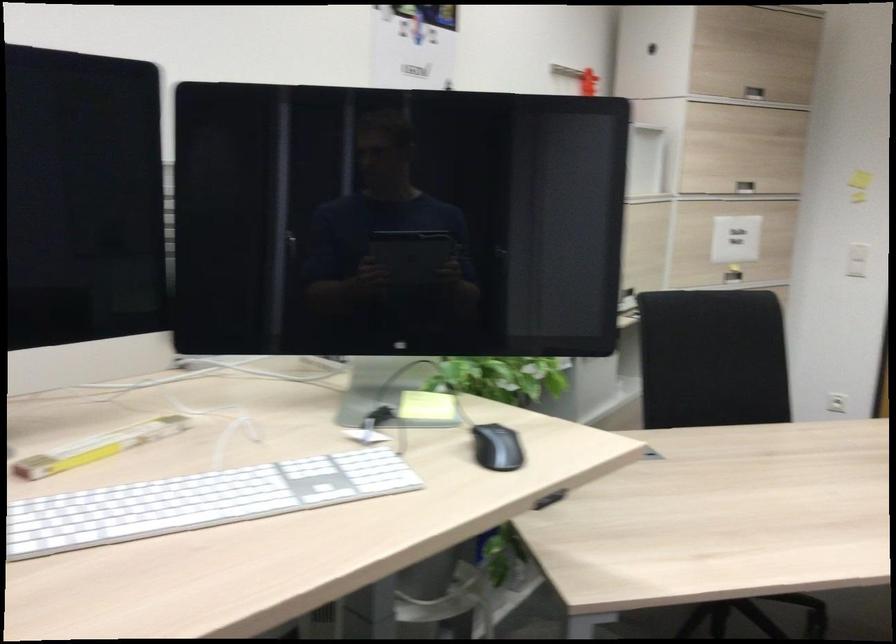
The width and height of the screenshot is (896, 644). Describe the element at coordinates (712, 359) in the screenshot. I see `the chair sitting surface` at that location.